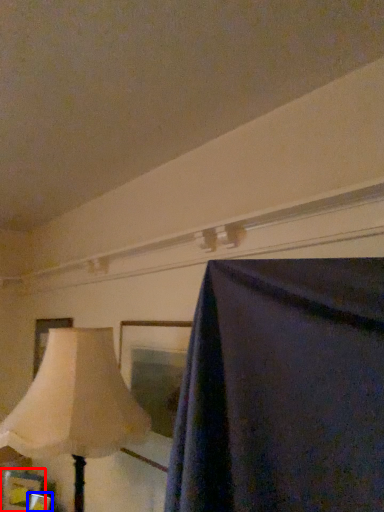
Question: Which point is closer to the camera, picture frame (highlighted by a red box) or picture frame (highlighted by a blue box)?

Choices:
 (A) picture frame
 (B) picture frame

Answer: (B)